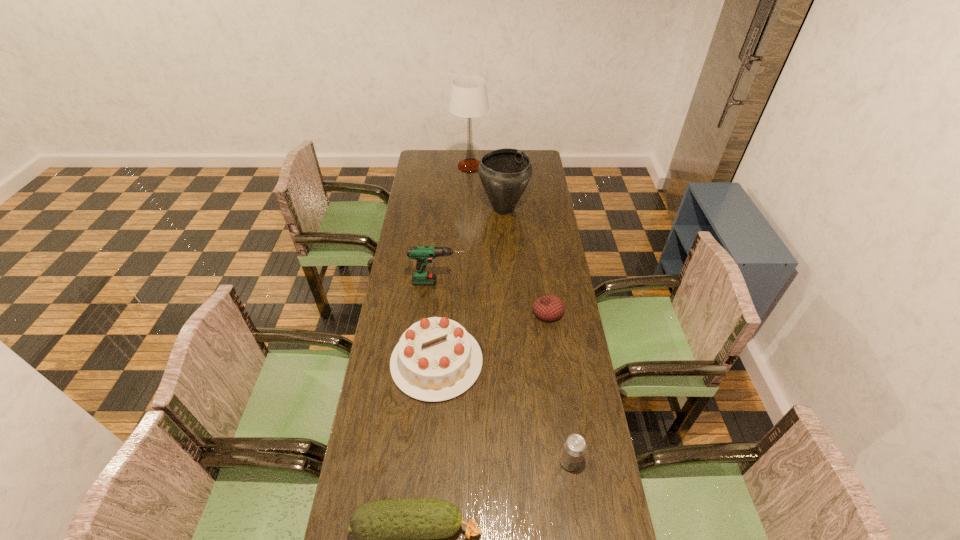
Where is `unoccupied area between the fourth nearest object and the third farthest object`? The height and width of the screenshot is (540, 960). unoccupied area between the fourth nearest object and the third farthest object is located at coordinates (493, 297).

This screenshot has height=540, width=960. In order to click on empty location between the birthday cake and the second farthest object in this screenshot , I will do pyautogui.click(x=470, y=285).

This screenshot has width=960, height=540. In order to click on the closest object to the third farthest object in this screenshot , I will do `click(436, 359)`.

This screenshot has height=540, width=960. I want to click on the second closest object to the farthest object, so click(423, 254).

Find the location of `free location that satisfies the following two spatial constraints: 1. on the back side of the beer can; 2. above the cylindrical shade of the tallest object`. free location that satisfies the following two spatial constraints: 1. on the back side of the beer can; 2. above the cylindrical shade of the tallest object is located at coordinates (528, 166).

This screenshot has width=960, height=540. Find the location of `vacant space that satisfies the following two spatial constraints: 1. on the handle side of the third tallest object; 2. on the left side of the third nearest object`. vacant space that satisfies the following two spatial constraints: 1. on the handle side of the third tallest object; 2. on the left side of the third nearest object is located at coordinates (431, 362).

You are a GUI agent. You are given a task and a screenshot of the screen. Output one action in this format:
    pyautogui.click(x=<x>, y=<y>)
    Task: Click on the vacant position in the image that satisfies the following two spatial constraints: 1. on the front side of the beer can; 2. on the right side of the fourth shortest object
    This screenshot has width=960, height=540.
    Given the screenshot: What is the action you would take?
    pyautogui.click(x=428, y=461)

Image resolution: width=960 pixels, height=540 pixels. I want to click on free space in the image that satisfies the following two spatial constraints: 1. on the handle side of the third farthest object; 2. on the back side of the fourth farthest object, so click(436, 312).

The height and width of the screenshot is (540, 960). Identify the location of vacant space that satisfies the following two spatial constraints: 1. on the handle side of the third farthest object; 2. on the back side of the third nearest object. (431, 362).